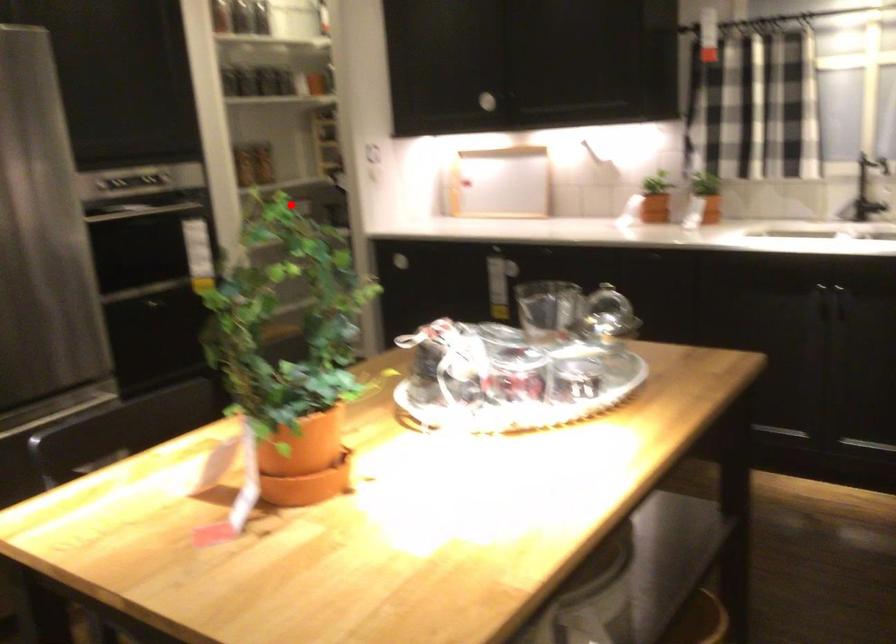
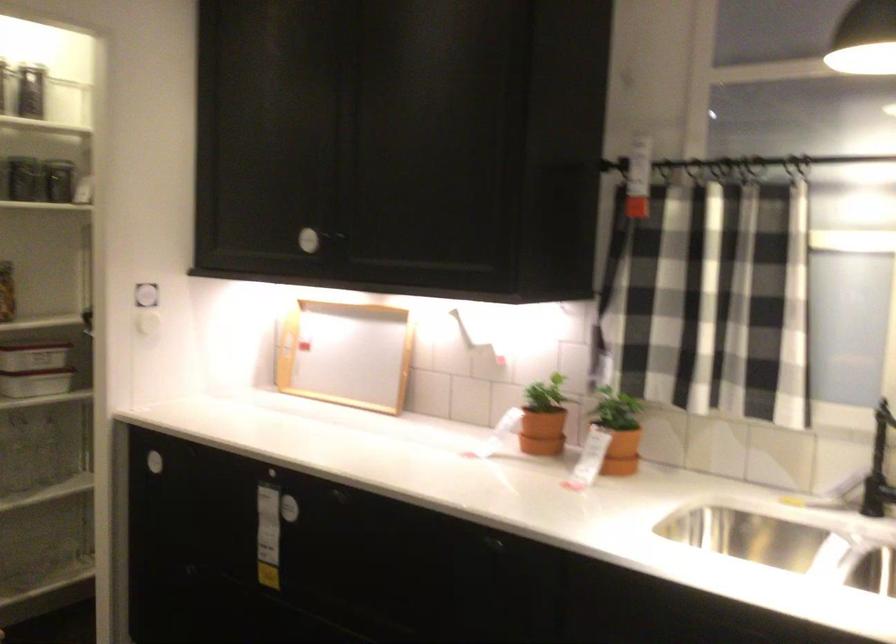
Locate, in the second image, the point that corresponds to the highlighted location in the first image.

(35, 368)